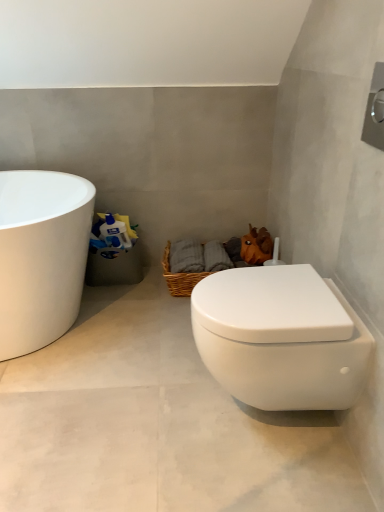
At what (x,y) coordinates should I click in order to perform the action: click on woven brown basket at center. Please return your answer as a coordinate pair (x, y). This screenshot has height=512, width=384. Looking at the image, I should click on [179, 277].

Image resolution: width=384 pixels, height=512 pixels. I want to click on orange matte plush toy at upper right, so click(256, 246).

Image resolution: width=384 pixels, height=512 pixels. What are the coordinates of `white glossy toilet at lower right` in the screenshot? It's located at (280, 338).

Locate an element on the screen. The width and height of the screenshot is (384, 512). white matte toilet at lower right is located at coordinates (156, 423).

Considering the sizes of objects woven brown basket at center and orange matte plush toy at upper right in the image provided, who is smaller, woven brown basket at center or orange matte plush toy at upper right?

orange matte plush toy at upper right.

At what (x,y) coordinates should I click in order to perform the action: click on basket behind the orange matte plush toy at upper right. Please return your answer as a coordinate pair (x, y). The image size is (384, 512). Looking at the image, I should click on (179, 277).

Do you think woven brown basket at center is within orange matte plush toy at upper right, or outside of it?

woven brown basket at center cannot be found inside orange matte plush toy at upper right.

Is white matte toilet at lower right not close to white glossy toilet at lower right?

No, white matte toilet at lower right is not far away from white glossy toilet at lower right.

From their relative heights in the image, would you say white matte toilet at lower right is taller or shorter than white glossy toilet at lower right?

Clearly, white matte toilet at lower right is shorter compared to white glossy toilet at lower right.

Looking at this image, between white matte toilet at lower right and white glossy toilet at lower right, which one is positioned behind?

white glossy toilet at lower right is further from the camera.

Is white matte toilet at lower right oriented towards white glossy toilet at lower right?

No.

From a real-world perspective, relative to white matte toilet at lower right, is white glossy toilet at lower right vertically above or below?

white glossy toilet at lower right is situated higher than white matte toilet at lower right in the real world.

Is white glossy toilet at lower right spatially inside white matte toilet at lower right, or outside of it?

white glossy toilet at lower right exists outside the volume of white matte toilet at lower right.

Relative to white matte toilet at lower right, is white glossy toilet at lower right in front or behind?

Clearly, white glossy toilet at lower right is behind white matte toilet at lower right.

Consider the image. Does orange matte plush toy at upper right turn towards white glossy toilet at lower right?

No, orange matte plush toy at upper right is not aimed at white glossy toilet at lower right.

Which is in front, point (268, 233) or point (247, 318)?

Positioned in front is point (247, 318).

Based on the photo, considering the sizes of objects orange matte plush toy at upper right and white glossy toilet at lower right in the image provided, who is shorter, orange matte plush toy at upper right or white glossy toilet at lower right?

orange matte plush toy at upper right.

From a real-world perspective, who is located higher, orange matte plush toy at upper right or white glossy toilet at lower right?

white glossy toilet at lower right.

Is white glossy toilet at lower right further to camera compared to woven brown basket at center?

That is False.

Do you think white glossy toilet at lower right is within woven brown basket at center, or outside of it?

white glossy toilet at lower right is outside woven brown basket at center.

Between white glossy toilet at lower right and woven brown basket at center, which one has smaller width?

white glossy toilet at lower right.

Find the location of a particular element. Image resolution: width=384 pixels, height=512 pixels. basket beneath the white glossy toilet at lower right (from a real-world perspective) is located at coordinates (179, 277).

Which of these two, orange matte plush toy at upper right or white matte toilet at lower right, is thinner?

Thinner between the two is orange matte plush toy at upper right.

From a real-world perspective, which object rests below the other?

In real-world perspective, white matte toilet at lower right is lower.

Could you tell me if orange matte plush toy at upper right is turned towards white matte toilet at lower right?

No.

Is orange matte plush toy at upper right placed right next to white matte toilet at lower right?

orange matte plush toy at upper right and white matte toilet at lower right are not in contact.

Looking at this image, is white matte toilet at lower right turned away from woven brown basket at center?

white matte toilet at lower right is not turned away from woven brown basket at center.

Which point is more distant from viewer, (58,417) or (173,280)?

Positioned behind is point (173,280).

How different are the orientations of white matte toilet at lower right and woven brown basket at center in degrees?

The angular difference between white matte toilet at lower right and woven brown basket at center is 88 degrees.

Considering the relative sizes of white matte toilet at lower right and woven brown basket at center in the image provided, is white matte toilet at lower right wider than woven brown basket at center?

Yes.

Identify the location of animal above the woven brown basket at center (from a real-world perspective). (256, 246).

Where is `toilet above the white matte toilet at lower right (from the image's perspective)`? This screenshot has width=384, height=512. toilet above the white matte toilet at lower right (from the image's perspective) is located at coordinates (280, 338).

From the image, which object appears to be farther from orange matte plush toy at upper right, white glossy toilet at lower right or white matte toilet at lower right?

white matte toilet at lower right lies further to orange matte plush toy at upper right than the other object.

Which object lies further to the anchor point orange matte plush toy at upper right, white matte toilet at lower right or woven brown basket at center?

white matte toilet at lower right is positioned further to the anchor orange matte plush toy at upper right.

When comparing their distances from white glossy toilet at lower right, does orange matte plush toy at upper right or woven brown basket at center seem further?

orange matte plush toy at upper right.

Which object lies further to the anchor point white glossy toilet at lower right, white matte toilet at lower right or orange matte plush toy at upper right?

The object further to white glossy toilet at lower right is orange matte plush toy at upper right.

Estimate the real-world distances between objects in this image. Which object is closer to orange matte plush toy at upper right, woven brown basket at center or white glossy toilet at lower right?

woven brown basket at center is positioned closer to the anchor orange matte plush toy at upper right.

Which object lies nearer to the anchor point white glossy toilet at lower right, woven brown basket at center or white matte toilet at lower right?

Among the two, white matte toilet at lower right is located nearer to white glossy toilet at lower right.

From the image, which object appears to be farther from white matte toilet at lower right, orange matte plush toy at upper right or white glossy toilet at lower right?

Among the two, orange matte plush toy at upper right is located further to white matte toilet at lower right.

Based on their spatial positions, is orange matte plush toy at upper right or white matte toilet at lower right closer to white glossy toilet at lower right?

The object closer to white glossy toilet at lower right is white matte toilet at lower right.

Where is `animal located between white glossy toilet at lower right and woven brown basket at center in the depth direction`? This screenshot has height=512, width=384. animal located between white glossy toilet at lower right and woven brown basket at center in the depth direction is located at coordinates (256, 246).

This screenshot has height=512, width=384. I want to click on toilet between white matte toilet at lower right and orange matte plush toy at upper right from front to back, so click(x=280, y=338).

The width and height of the screenshot is (384, 512). I want to click on toilet between white matte toilet at lower right and woven brown basket at center in the front-back direction, so click(x=280, y=338).

I want to click on animal between white matte toilet at lower right and woven brown basket at center along the z-axis, so click(256, 246).